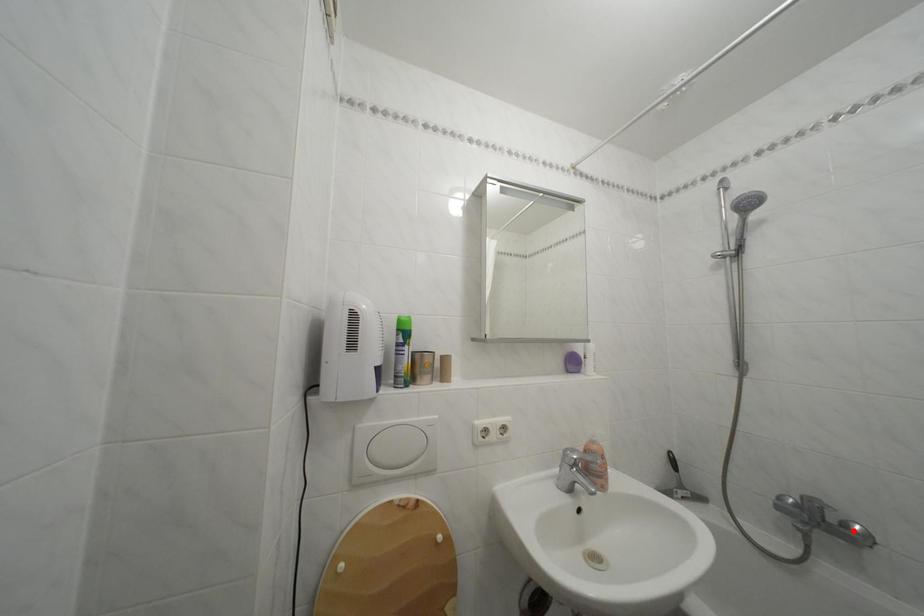
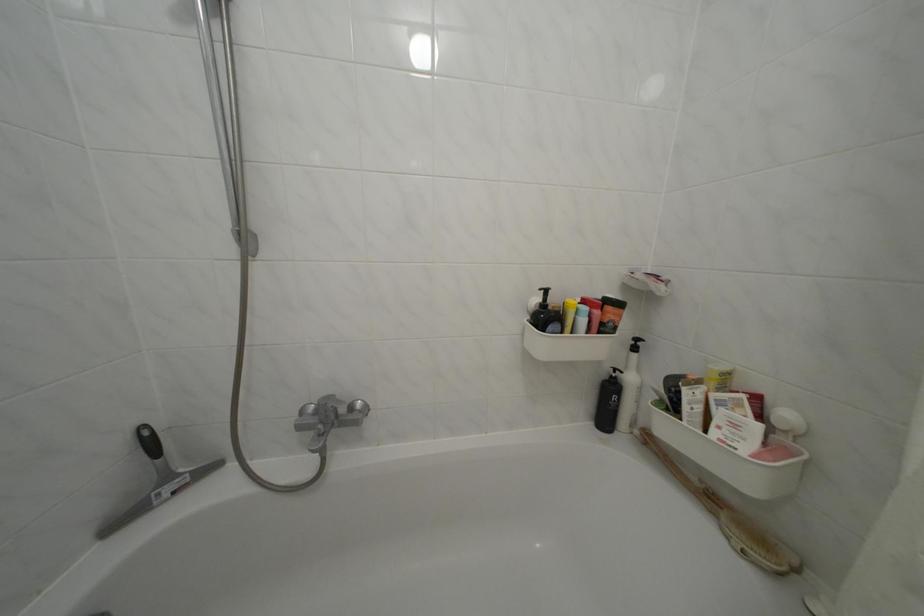
Question: I am providing you with two images of the same scene from different viewpoints. Given a red point in image1, look at the same physical point in image2. Is it:

Choices:
 (A) Closer to the viewpoint
 (B) Farther from the viewpoint

Answer: (B)